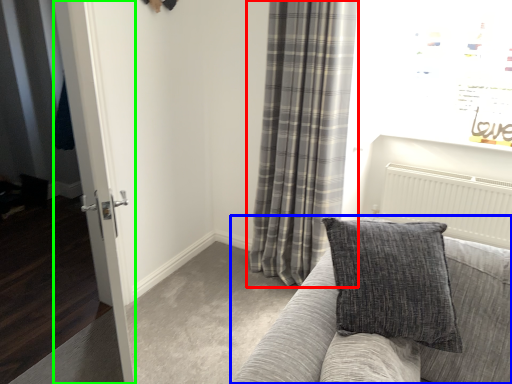
Question: Which object is positioned closest to curtain (highlighted by a red box)? Select from studio couch (highlighted by a blue box) and glass door (highlighted by a green box).

Choices:
 (A) studio couch
 (B) glass door

Answer: (B)